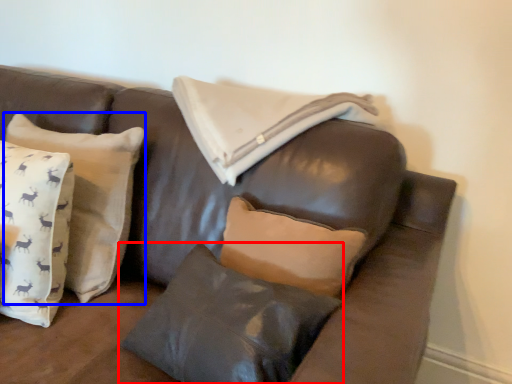
Question: Among these objects, which one is farthest to the camera, pillow (highlighted by a red box) or pillow (highlighted by a blue box)?

Choices:
 (A) pillow
 (B) pillow

Answer: (B)